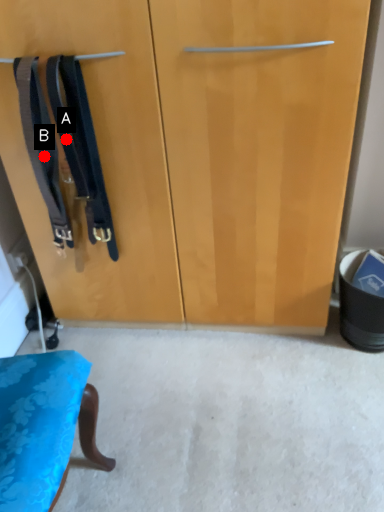
Question: Two points are circled on the image, labeled by A and B beside each circle. Which of the following is the farthest from the observer?

Choices:
 (A) A is further
 (B) B is further

Answer: (B)